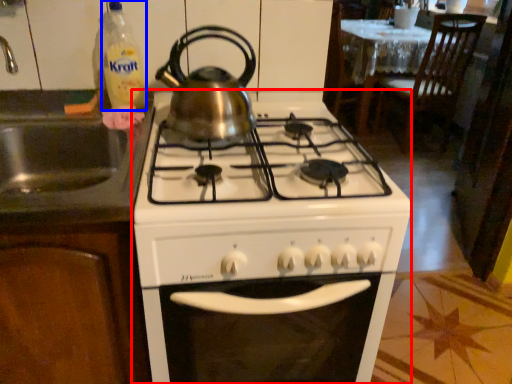
Question: Which object is further to the camera taking this photo, gas stove (highlighted by a red box) or bottle (highlighted by a blue box)?

Choices:
 (A) gas stove
 (B) bottle

Answer: (B)